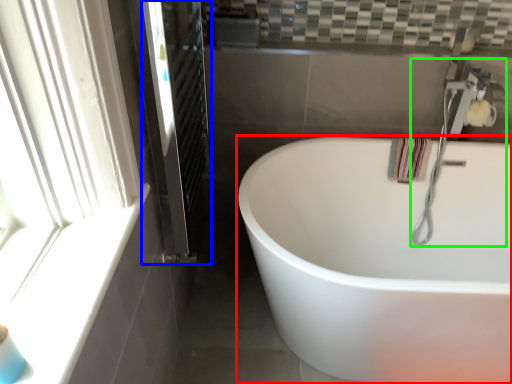
Question: Which object is positioned farthest from bathtub (highlighted by a red box)? Select from screen door (highlighted by a blue box) and faucet (highlighted by a green box).

Choices:
 (A) screen door
 (B) faucet

Answer: (A)